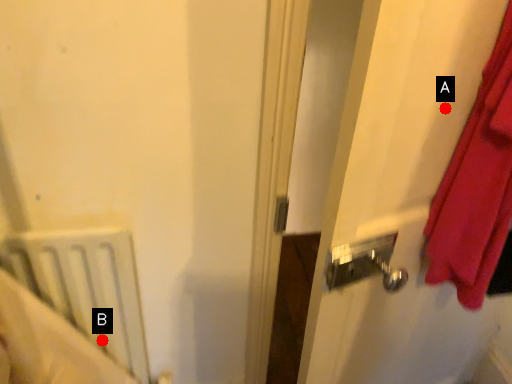
Question: Two points are circled on the image, labeled by A and B beside each circle. Which point is closer to the camera taking this photo?

Choices:
 (A) A is closer
 (B) B is closer

Answer: (A)